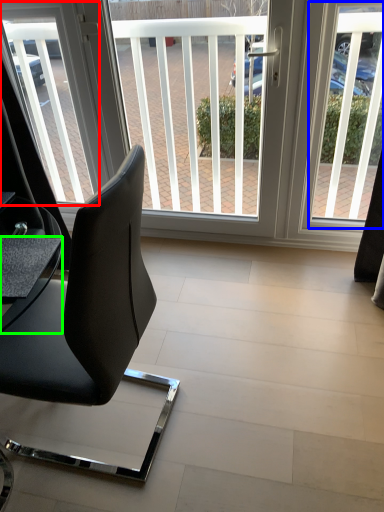
Question: Which object is the farthest from window screen (highlighted by a red box)? Choose among these: window screen (highlighted by a blue box) or table (highlighted by a green box).

Choices:
 (A) window screen
 (B) table

Answer: (A)